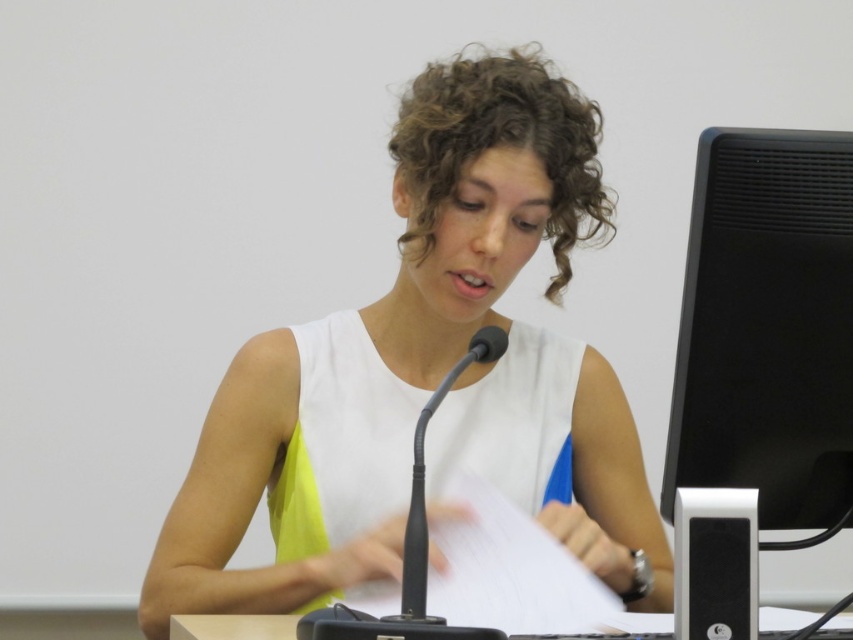
You are a photographer trying to capture a candid shot of the speaker during their presentation. You notice two points of interest marked at coordinates point (662, 515) and point (846, 621). Which point is better to focus on to ensure the subject remains in focus without moving the camera?

Point (662, 515) is closer to the viewer than point (846, 621), so focusing on it would keep the subject in focus without needing to adjust the camera position.

You are organizing a photoshoot and need to place a decorative vase between the white matte dress at center and the white plastic table at lower center. According to the scene, which side of the table should you place it on?

The white matte dress at center is to the left of the white plastic table at lower center, so you should place the vase to the left side of the white plastic table at lower center to position it between them.

You are a photographer standing at the camera position. You want to capture a closeup shot of the microphone. The microphone is located at point (422, 522). There is a person holding a paper in front of you. Can you fit the microphone into the frame without moving the camera?

The distance between the camera and point (422, 522) is 96.65 centimeters. Since the microphone is at that point and the person is in front of the camera, the microphone might be partially or fully blocked by the person. To determine if it can fit without moving, check if the microphone is visible around or beyond the person. If the person is between the camera and the microphone, moving might be necessary.